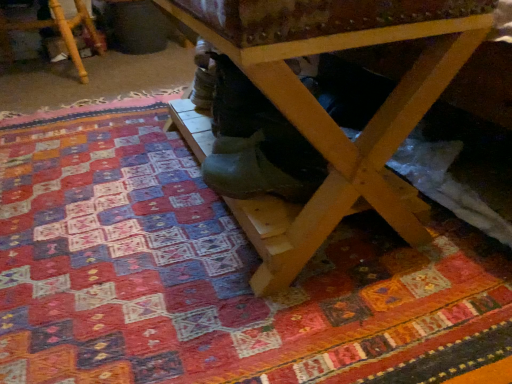
Question: Would you say wooden stool at lower left is part of wooden table at center's contents?

Choices:
 (A) yes
 (B) no

Answer: (B)

Question: Is wooden table at center located outside wooden stool at lower left?

Choices:
 (A) no
 (B) yes

Answer: (B)

Question: Are wooden table at center and wooden stool at lower left located far from each other?

Choices:
 (A) yes
 (B) no

Answer: (A)

Question: Is wooden table at center bigger than wooden stool at lower left?

Choices:
 (A) yes
 (B) no

Answer: (A)

Question: Does wooden table at center have a lesser height compared to wooden stool at lower left?

Choices:
 (A) no
 (B) yes

Answer: (A)

Question: Looking at their shapes, would you say wooden stool at lower left is wider or thinner than wooden table at center?

Choices:
 (A) thin
 (B) wide

Answer: (B)

Question: Is wooden stool at lower left spatially inside wooden table at center, or outside of it?

Choices:
 (A) outside
 (B) inside

Answer: (A)

Question: From a real-world perspective, is wooden stool at lower left physically located above or below wooden table at center?

Choices:
 (A) below
 (B) above

Answer: (A)

Question: From the image's perspective, is wooden stool at lower left above or below wooden table at center?

Choices:
 (A) below
 (B) above

Answer: (B)

Question: Considering the positions of green rubber boot at center and wooden table at center in the image, is green rubber boot at center taller or shorter than wooden table at center?

Choices:
 (A) tall
 (B) short

Answer: (B)

Question: Does point (279, 152) appear closer or farther from the camera than point (332, 127)?

Choices:
 (A) farther
 (B) closer

Answer: (A)

Question: In terms of width, does green rubber boot at center look wider or thinner when compared to wooden table at center?

Choices:
 (A) thin
 (B) wide

Answer: (A)

Question: Is green rubber boot at center in front of or behind wooden table at center in the image?

Choices:
 (A) behind
 (B) front

Answer: (A)

Question: Based on their sizes in the image, would you say green rubber boot at center is bigger or smaller than wooden stool at lower left?

Choices:
 (A) small
 (B) big

Answer: (A)

Question: Is green rubber boot at center inside or outside of wooden stool at lower left?

Choices:
 (A) inside
 (B) outside

Answer: (B)